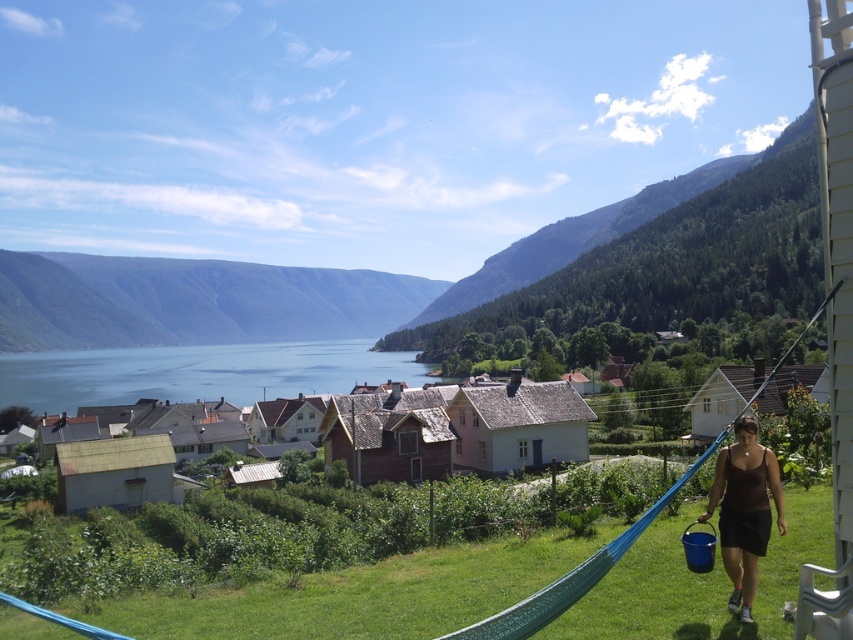
Question: Can you confirm if green forested mountain at upper center is positioned to the right of brown fabric dress at lower right?

Choices:
 (A) no
 (B) yes

Answer: (A)

Question: Which of these objects is positioned closest to the green grassy mountain at left?

Choices:
 (A) blue water at center
 (B) green forested mountain at upper center

Answer: (B)

Question: Does green forested mountain at upper center appear over green grassy mountain at left?

Choices:
 (A) no
 (B) yes

Answer: (B)

Question: Which point is farther to the camera?

Choices:
 (A) tap(50, 260)
 (B) tap(776, 472)

Answer: (A)

Question: Can you confirm if green grassy mountain at left is positioned to the right of blue water at center?

Choices:
 (A) no
 (B) yes

Answer: (A)

Question: Among these objects, which one is nearest to the camera?

Choices:
 (A) green grassy mountain at left
 (B) green forested mountain at upper center
 (C) brown fabric dress at lower right
 (D) blue water at center

Answer: (C)